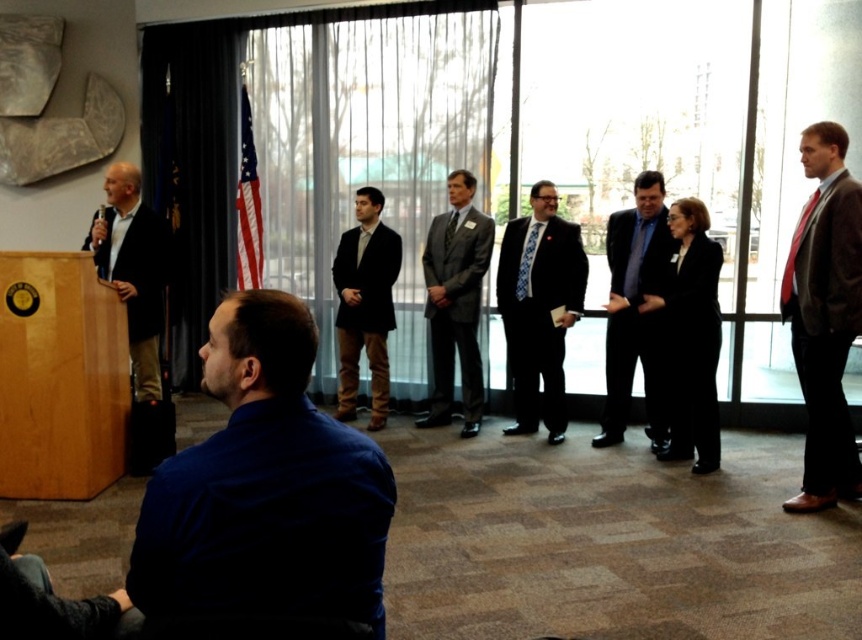
Does matte black suit at center come in front of black matte suit at center?

No, it is behind black matte suit at center.

Who is positioned more to the left, matte black suit at center or black matte suit at center?

From the viewer's perspective, matte black suit at center appears more on the left side.

This screenshot has height=640, width=862. I want to click on matte black suit at center, so click(x=635, y=312).

Identify the location of matte black suit at center. (635, 312).

Identify the location of dark blue shirt at lower left. (265, 486).

Does dark blue shirt at lower left have a lesser height compared to dark gray wool suit at left?

Indeed, dark blue shirt at lower left has a lesser height compared to dark gray wool suit at left.

Between point (378, 576) and point (147, 368), which one is positioned in front?

Point (378, 576) is in front.

At what (x,y) coordinates should I click in order to perform the action: click on dark blue shirt at lower left. Please return your answer as a coordinate pair (x, y). Looking at the image, I should click on (265, 486).

Who is positioned more to the left, blue patterned tie at center or dark brown suit at center?

dark brown suit at center

Can you confirm if blue patterned tie at center is thinner than dark brown suit at center?

In fact, blue patterned tie at center might be wider than dark brown suit at center.

At what (x,y) coordinates should I click in order to perform the action: click on blue patterned tie at center. Please return your answer as a coordinate pair (x, y). The width and height of the screenshot is (862, 640). Looking at the image, I should click on (539, 307).